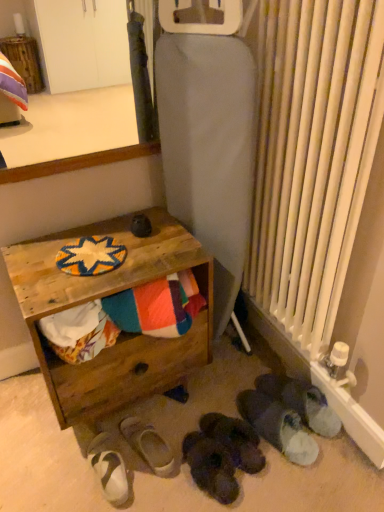
Image resolution: width=384 pixels, height=512 pixels. Identify the location of blank space to the left of black suede slippers at lower center, acting as the 4th footwear starting from the left. (169, 438).